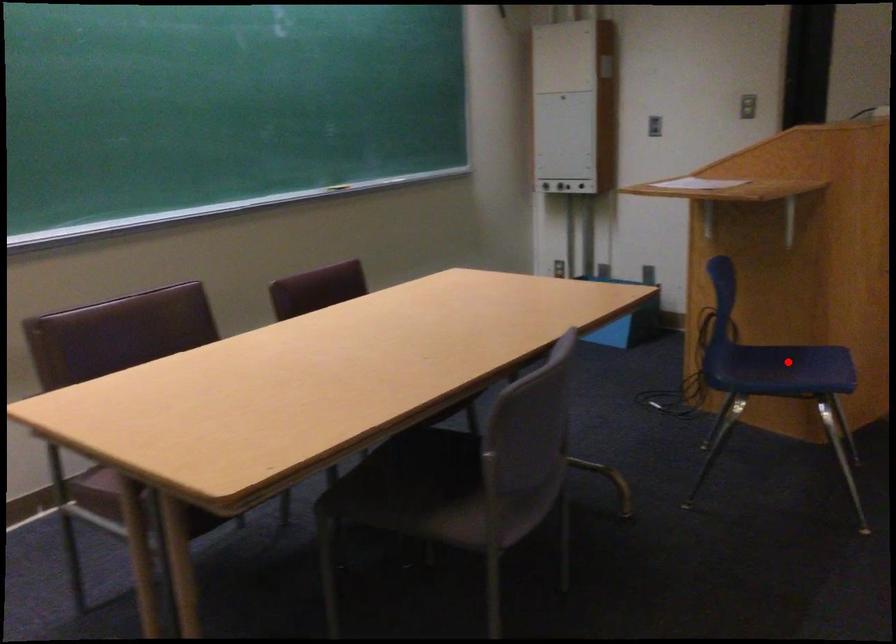
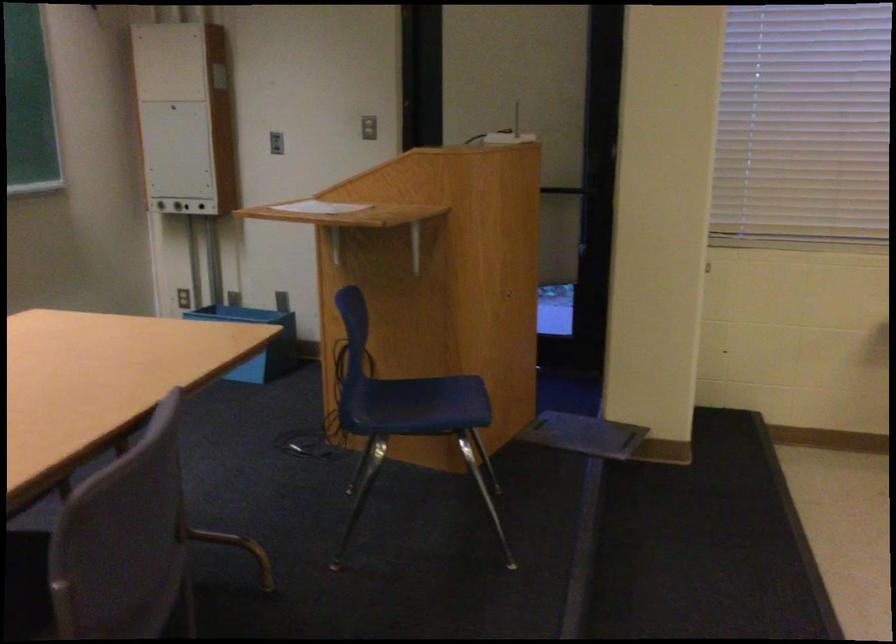
Locate, in the second image, the point that corresponds to the highlighted location in the first image.

(424, 398)